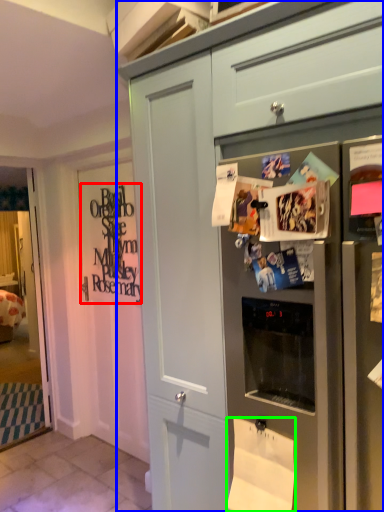
Question: Based on their relative distances, which object is farther from signature (highlighted by a red box)? Choose from cabinetry (highlighted by a blue box) and toilet paper (highlighted by a green box).

Choices:
 (A) cabinetry
 (B) toilet paper

Answer: (B)